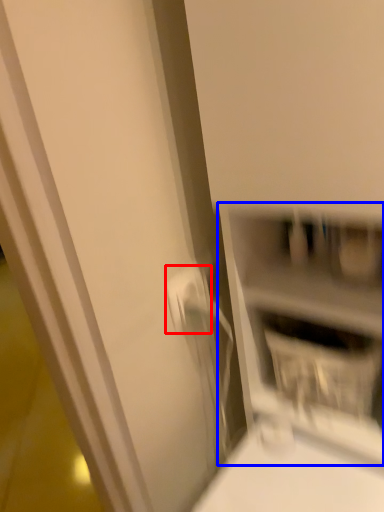
Question: Which object appears farthest to the camera in this image, electric outlet (highlighted by a red box) or shelf (highlighted by a blue box)?

Choices:
 (A) electric outlet
 (B) shelf

Answer: (A)